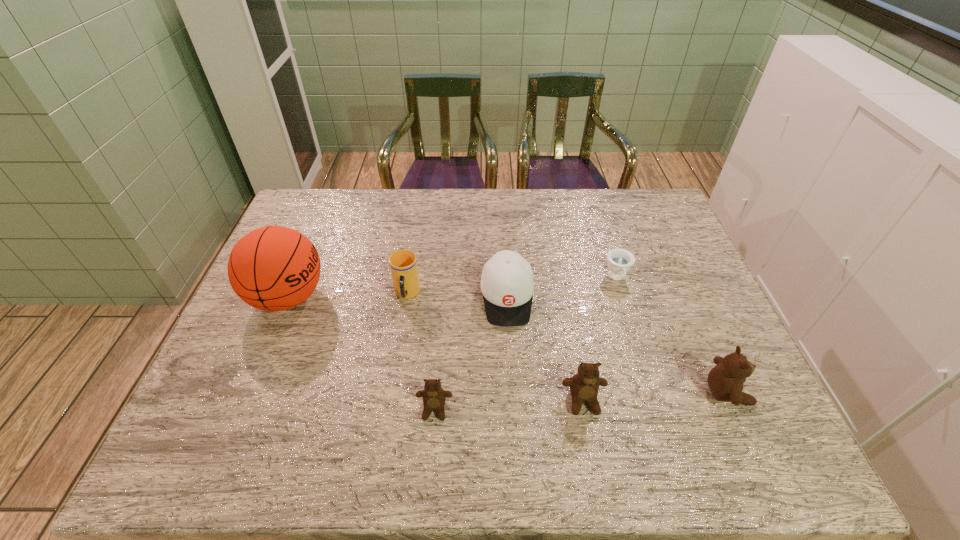
Where is `vacant region at the near edge of the desktop`? The image size is (960, 540). vacant region at the near edge of the desktop is located at coordinates (392, 412).

Locate an element on the screen. The image size is (960, 540). vacant position at the left edge of the desktop is located at coordinates (266, 349).

The height and width of the screenshot is (540, 960). I want to click on free region at the right edge of the desktop, so click(x=673, y=275).

Find the location of a particular element. The image size is (960, 540). vacant space at the far left corner is located at coordinates (304, 189).

You are a GUI agent. You are given a task and a screenshot of the screen. Output one action in this format:
    pyautogui.click(x=<x>, y=<y>)
    Task: Click on the unoccupied area between the second shortest object and the teacup
    
    Given the screenshot: What is the action you would take?
    pyautogui.click(x=526, y=343)

Locate an element on the screen. The height and width of the screenshot is (540, 960). vacant area between the sixth object from right to left and the rightmost object is located at coordinates (567, 343).

The width and height of the screenshot is (960, 540). What are the coordinates of `unoccupied area between the shortest teddy bear and the second object from left to right` in the screenshot? It's located at (420, 352).

Where is `free point between the tallest teddy bear and the teacup`? The image size is (960, 540). free point between the tallest teddy bear and the teacup is located at coordinates (672, 335).

In order to click on free area in between the baseball cap and the rightmost object in this screenshot , I will do `click(617, 345)`.

Where is `vacant space in between the second tallest teddy bear and the sixth tallest object`? vacant space in between the second tallest teddy bear and the sixth tallest object is located at coordinates (509, 405).